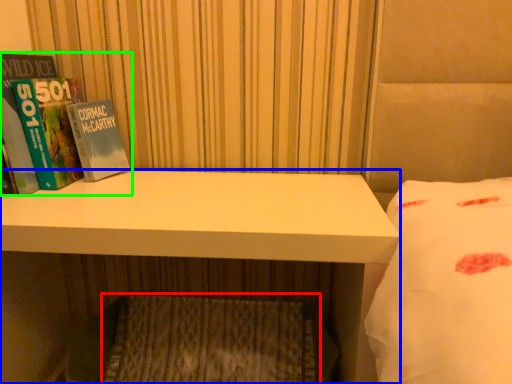
Question: Which object is positioned farthest from mattress (highlighted by a red box)? Select from desk (highlighted by a blue box) and book (highlighted by a green box).

Choices:
 (A) desk
 (B) book

Answer: (B)